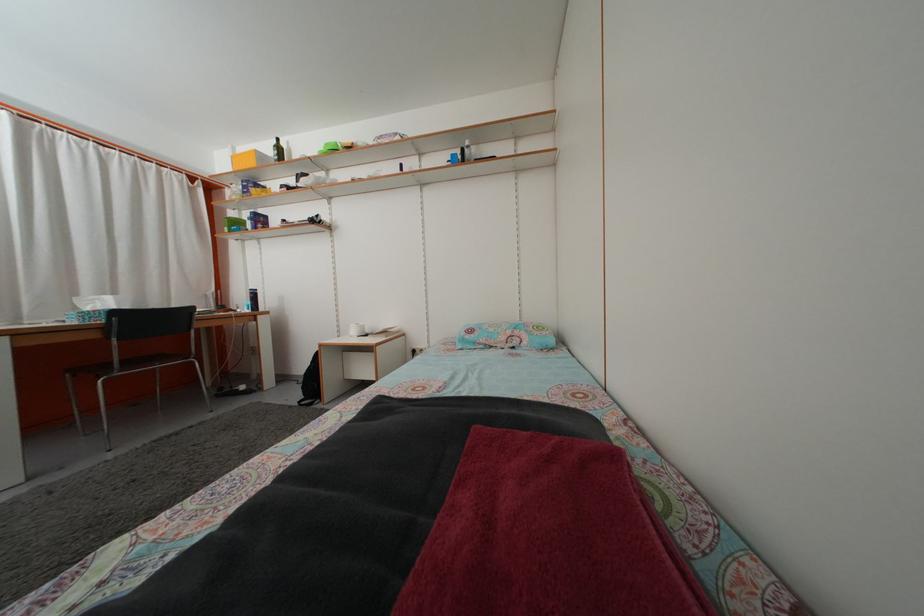
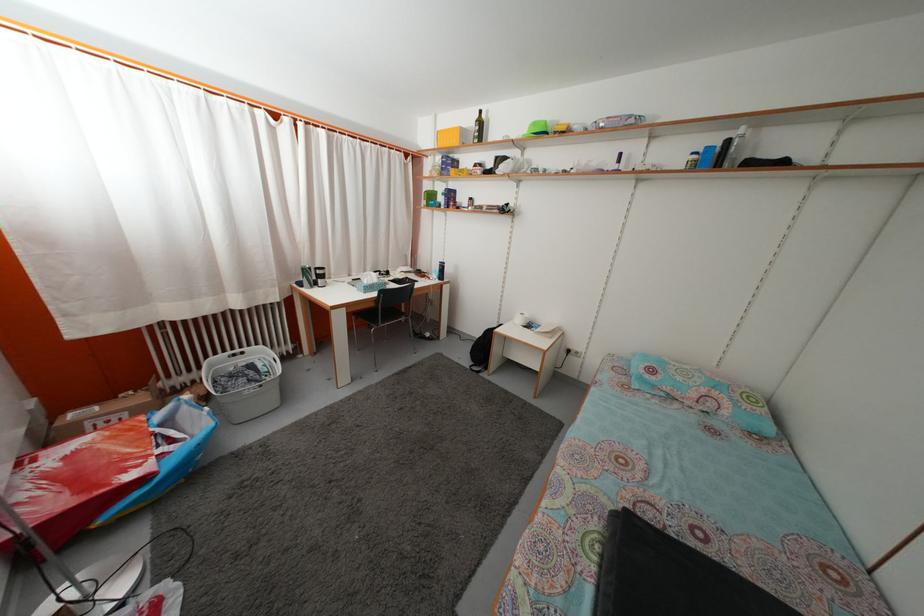
Where in the second image is the point corresponding to point 265,163 from the first image?

(468, 139)